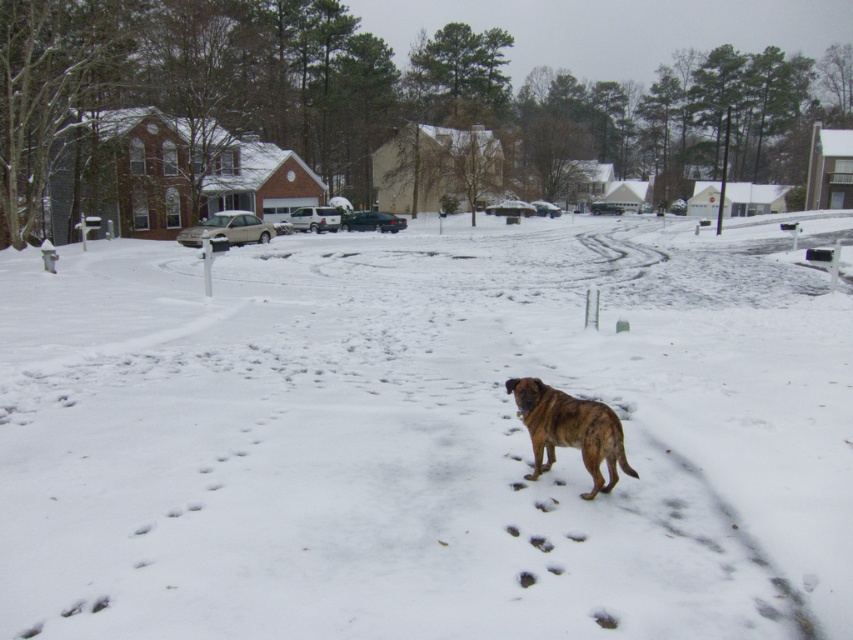
Is white fluffy snow at center to the right of brindle fur dog at center from the viewer's perspective?

In fact, white fluffy snow at center is to the left of brindle fur dog at center.

The image size is (853, 640). What do you see at coordinates (422, 435) in the screenshot? I see `white fluffy snow at center` at bounding box center [422, 435].

At what (x,y) coordinates should I click in order to perform the action: click on white fluffy snow at center. Please return your answer as a coordinate pair (x, y). Looking at the image, I should click on (422, 435).